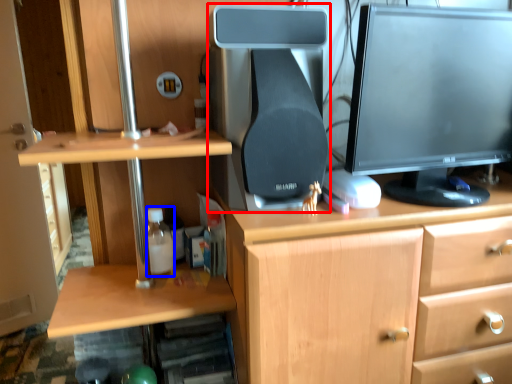
Question: Which object is closer to the camera taking this photo, desktop computer (highlighted by a red box) or bottle (highlighted by a blue box)?

Choices:
 (A) desktop computer
 (B) bottle

Answer: (A)